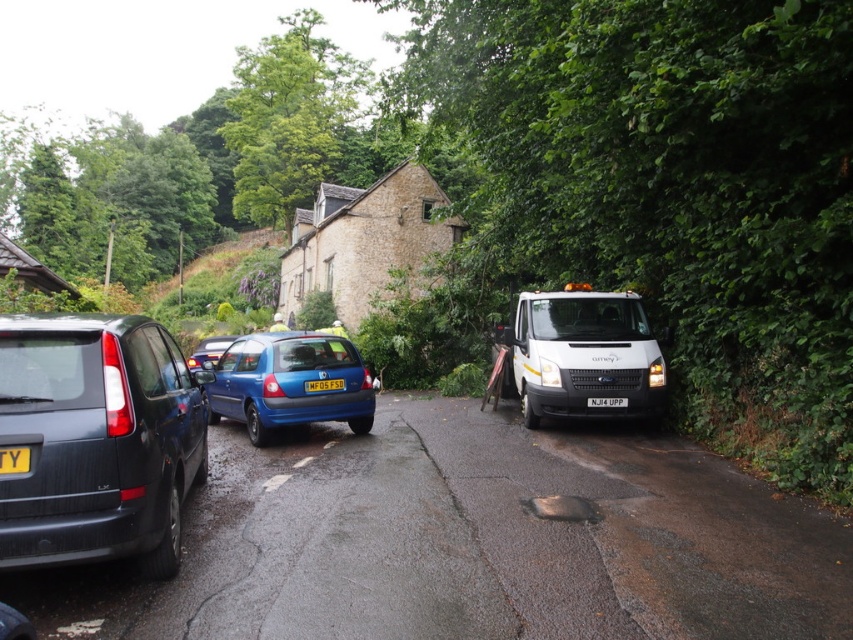
Does matte blue hatchback at center have a greater width compared to black plastic license plate at center?

Yes.

Who is lower down, matte blue hatchback at center or black plastic license plate at center?

black plastic license plate at center is lower down.

Who is more distant from viewer, (364, 429) or (604, 406)?

Point (364, 429)

This screenshot has height=640, width=853. In order to click on matte blue hatchback at center in this screenshot , I will do `click(288, 381)`.

The width and height of the screenshot is (853, 640). Describe the element at coordinates (96, 440) in the screenshot. I see `matte black minivan at left` at that location.

Is matte black minivan at left to the right of black plastic license plate at center from the viewer's perspective?

In fact, matte black minivan at left is to the left of black plastic license plate at center.

This screenshot has height=640, width=853. I want to click on matte black minivan at left, so click(x=96, y=440).

Identify the location of matte black minivan at left. Image resolution: width=853 pixels, height=640 pixels. (96, 440).

Does yellow plastic license plate at center have a greater width compared to yellow matte license plate at center?

Incorrect, yellow plastic license plate at center's width does not surpass yellow matte license plate at center's.

Is yellow plastic license plate at center below yellow matte license plate at center?

No, yellow plastic license plate at center is not below yellow matte license plate at center.

Where is `yellow plastic license plate at center`? This screenshot has width=853, height=640. yellow plastic license plate at center is located at coordinates coord(15,460).